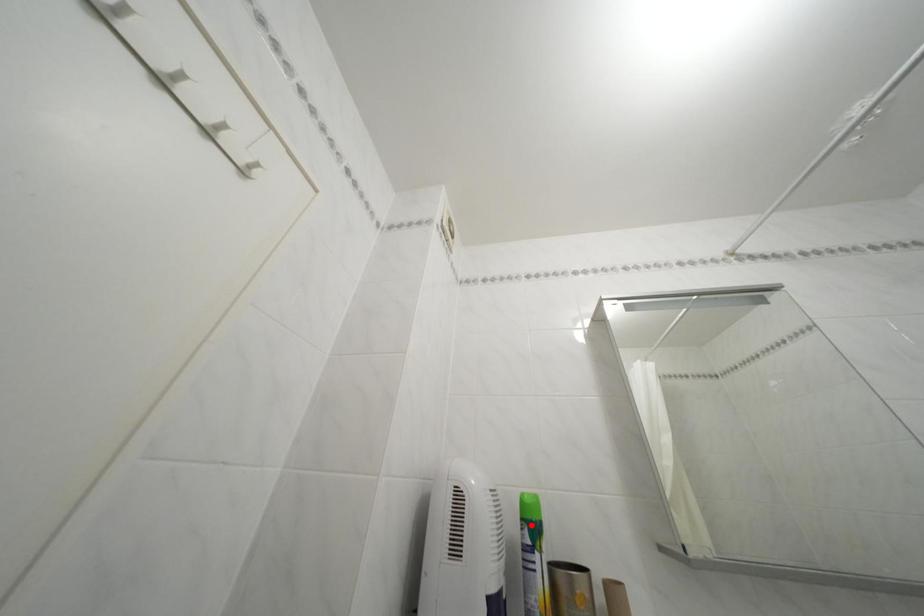
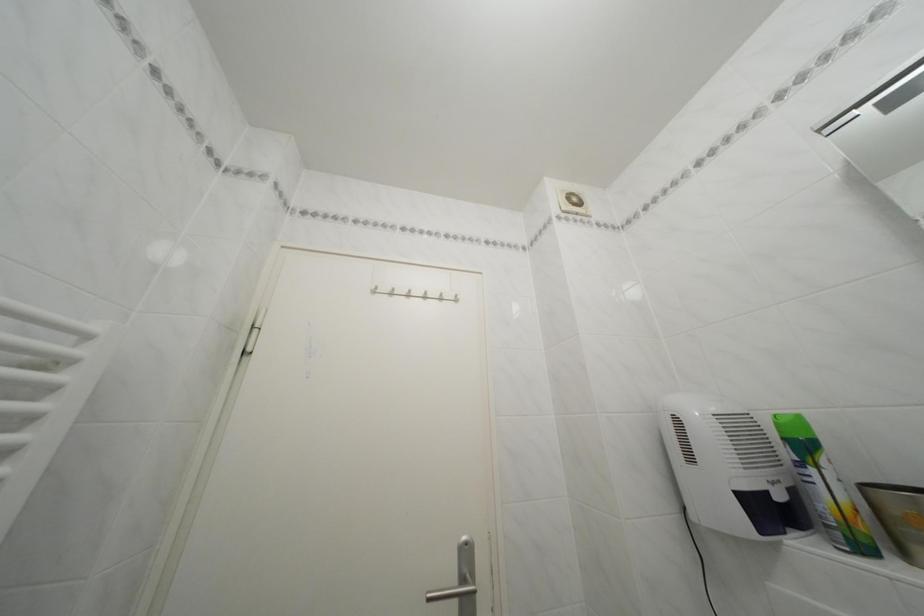
The point at the highlighted location is marked in the first image. Where is the corresponding point in the second image?

(793, 445)